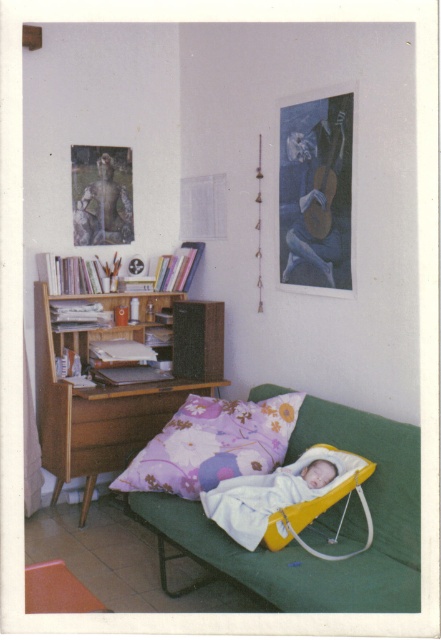
Does point (342, 424) come in front of point (347, 480)?

No, (342, 424) is behind (347, 480).

Does green fabric couch at lower center have a greater height compared to yellow plastic infant bed at center?

Indeed, green fabric couch at lower center has a greater height compared to yellow plastic infant bed at center.

Image resolution: width=441 pixels, height=640 pixels. Describe the element at coordinates (302, 548) in the screenshot. I see `green fabric couch at lower center` at that location.

The image size is (441, 640). I want to click on green fabric couch at lower center, so 302,548.

Which is behind, point (329, 269) or point (220, 416)?

Positioned behind is point (329, 269).

Locate an element on the screen. This screenshot has height=640, width=441. blue fabric painting at upper right is located at coordinates pyautogui.click(x=316, y=193).

Locate an element on the screen. blue fabric painting at upper right is located at coordinates (316, 193).

Which of these two, blue fabric painting at upper right or wooden carved statue at upper left, stands shorter?

With less height is wooden carved statue at upper left.

Identify the location of blue fabric painting at upper right. tap(316, 193).